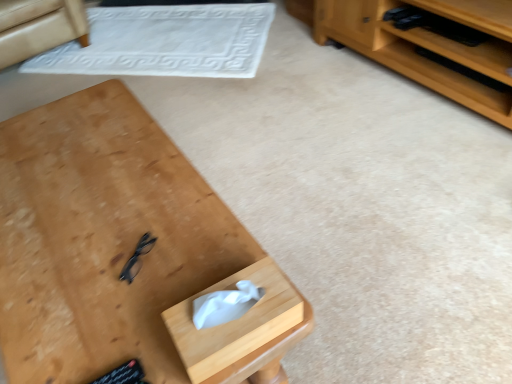
Find the location of `vacant area that lies to the right of wooden desk at center`. vacant area that lies to the right of wooden desk at center is located at coordinates (365, 237).